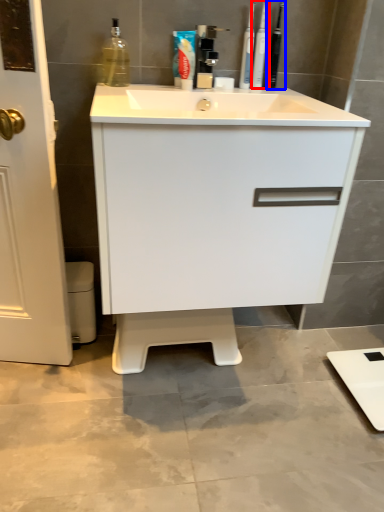
Question: Which of the following is the closest to the observer, toiletry (highlighted by a red box) or toiletry (highlighted by a blue box)?

Choices:
 (A) toiletry
 (B) toiletry

Answer: (A)